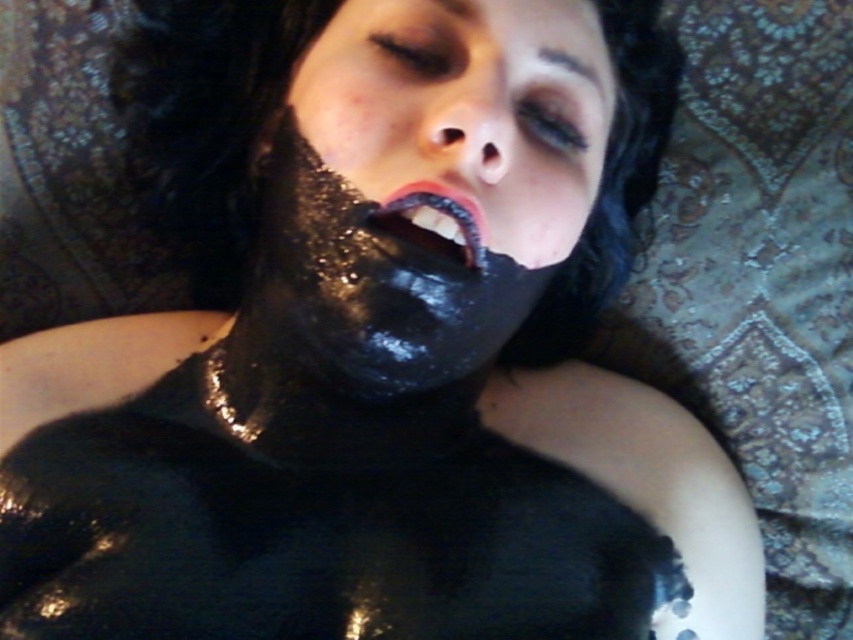
Question: Is black matte mask at center above shiny black lips at center?

Choices:
 (A) yes
 (B) no

Answer: (A)

Question: Which object appears closest to the camera in this image?

Choices:
 (A) shiny black lips at center
 (B) black matte mask at center

Answer: (B)

Question: Is black matte mask at center below shiny black lips at center?

Choices:
 (A) no
 (B) yes

Answer: (A)

Question: Which point is farther from the camera taking this photo?

Choices:
 (A) (572, 147)
 (B) (426, 200)

Answer: (A)

Question: Is black matte mask at center smaller than shiny black lips at center?

Choices:
 (A) no
 (B) yes

Answer: (A)

Question: Which point appears farthest from the camera in this image?

Choices:
 (A) (532, 90)
 (B) (451, 192)

Answer: (A)